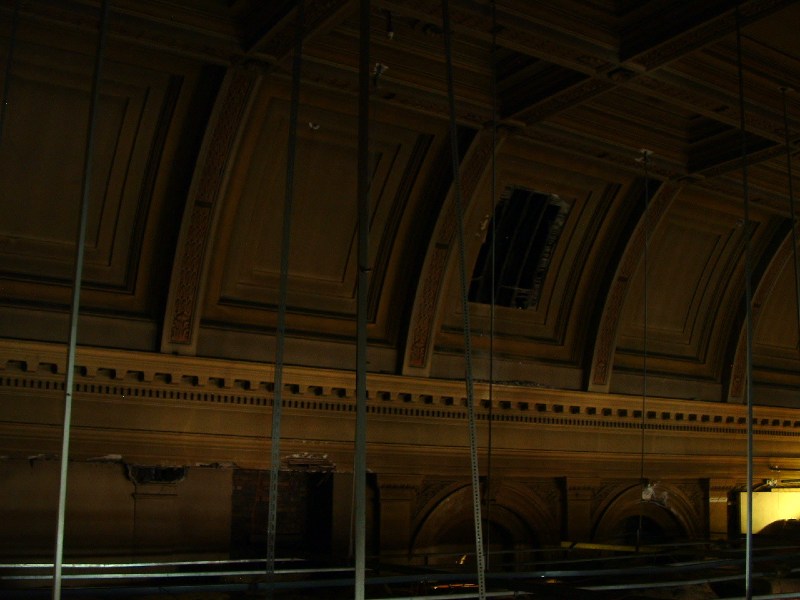
Locate an element on the screen. The height and width of the screenshot is (600, 800). damage area of the wall is located at coordinates (312, 464).